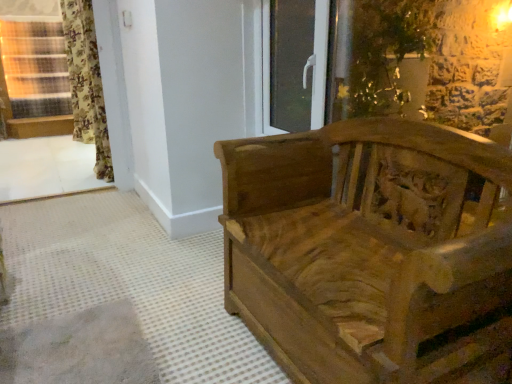
Question: From a real-world perspective, relative to transparent glass door at upper center, is wooden carved bench at right vertically above or below?

Choices:
 (A) below
 (B) above

Answer: (A)

Question: Is wooden carved bench at right taller or shorter than transparent glass door at upper center?

Choices:
 (A) tall
 (B) short

Answer: (A)

Question: Which object is positioned farthest from the wooden window frame at lower left?

Choices:
 (A) transparent glass door at upper center
 (B) floral fabric curtain at left
 (C) wooden carved bench at right

Answer: (C)

Question: Estimate the real-world distances between objects in this image. Which object is farther from the floral fabric curtain at left?

Choices:
 (A) transparent glass door at upper center
 (B) wooden window frame at lower left
 (C) wooden carved bench at right

Answer: (C)